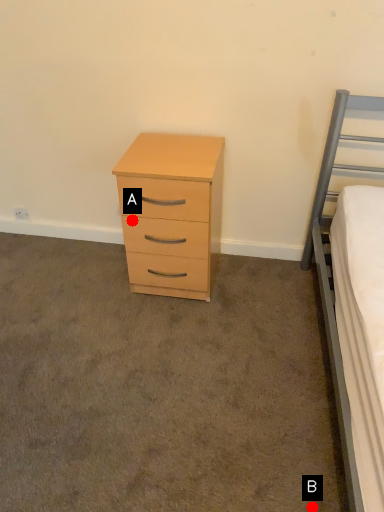
Question: Two points are circled on the image, labeled by A and B beside each circle. Which point appears farthest from the camera in this image?

Choices:
 (A) A is further
 (B) B is further

Answer: (A)